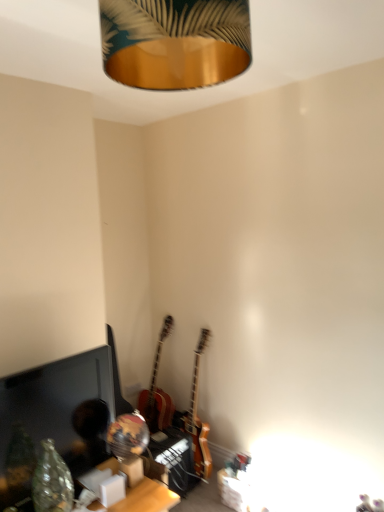
Question: Is wooden table at lower center bigger than wooden acoustic guitar at center, the first guitar viewed from the left?

Choices:
 (A) yes
 (B) no

Answer: (B)

Question: Can we say wooden table at lower center lies outside wooden acoustic guitar at center, which is counted as the second guitar, starting from the right?

Choices:
 (A) no
 (B) yes

Answer: (B)

Question: From the image's perspective, is wooden table at lower center under wooden acoustic guitar at center, the first guitar viewed from the left?

Choices:
 (A) no
 (B) yes

Answer: (B)

Question: Is wooden table at lower center at the right side of wooden acoustic guitar at center, the first guitar viewed from the left?

Choices:
 (A) no
 (B) yes

Answer: (A)

Question: Is there a large distance between wooden table at lower center and wooden acoustic guitar at center, which is counted as the second guitar, starting from the right?

Choices:
 (A) yes
 (B) no

Answer: (B)

Question: Considering the positions of matte black monitor at lower left and gold metallic lampshade at upper center in the image, is matte black monitor at lower left taller or shorter than gold metallic lampshade at upper center?

Choices:
 (A) tall
 (B) short

Answer: (A)

Question: Considering the positions of matte black monitor at lower left and gold metallic lampshade at upper center in the image, is matte black monitor at lower left wider or thinner than gold metallic lampshade at upper center?

Choices:
 (A) wide
 (B) thin

Answer: (B)

Question: Considering their positions, is matte black monitor at lower left located in front of or behind gold metallic lampshade at upper center?

Choices:
 (A) front
 (B) behind

Answer: (B)

Question: From a real-world perspective, is matte black monitor at lower left physically located above or below gold metallic lampshade at upper center?

Choices:
 (A) below
 (B) above

Answer: (A)

Question: Is wooden electric guitar at center, the 1th guitar positioned from the right, wider or thinner than wooden table at lower center?

Choices:
 (A) thin
 (B) wide

Answer: (A)

Question: From the image's perspective, relative to wooden table at lower center, is wooden electric guitar at center, the 1th guitar positioned from the right, above or below?

Choices:
 (A) below
 (B) above

Answer: (B)

Question: Is wooden electric guitar at center, the 1th guitar positioned from the right, in front of or behind wooden table at lower center in the image?

Choices:
 (A) behind
 (B) front

Answer: (A)

Question: From a real-world perspective, is wooden electric guitar at center, which ranks as the second guitar in left-to-right order, positioned above or below wooden table at lower center?

Choices:
 (A) above
 (B) below

Answer: (A)

Question: In terms of width, does gold metallic lampshade at upper center look wider or thinner when compared to matte black monitor at lower left?

Choices:
 (A) thin
 (B) wide

Answer: (B)

Question: From a real-world perspective, is gold metallic lampshade at upper center physically located above or below matte black monitor at lower left?

Choices:
 (A) below
 (B) above

Answer: (B)